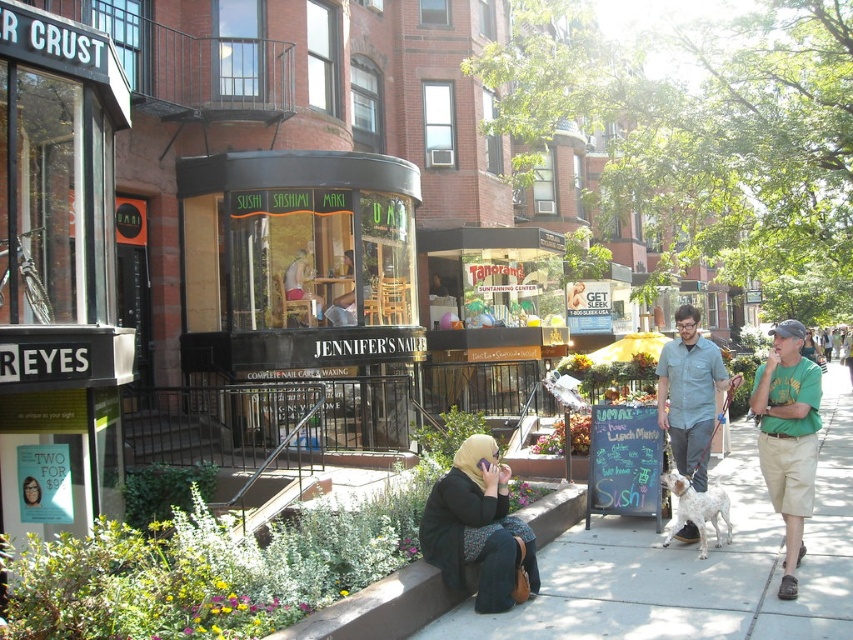
Question: Which point is closer to the camera taking this photo?

Choices:
 (A) (666, 428)
 (B) (769, 477)

Answer: (B)

Question: Does dark gray concrete curb at lower center have a smaller size compared to light blue shirt at center?

Choices:
 (A) yes
 (B) no

Answer: (A)

Question: Is concrete sidewalk at lower center positioned behind light blue shirt at center?

Choices:
 (A) no
 (B) yes

Answer: (A)

Question: Which point is farther to the camera?

Choices:
 (A) (428, 520)
 (B) (740, 595)
 (C) (276, 289)
 (D) (659, 412)

Answer: (C)

Question: Is the position of green cotton shirt at right less distant than that of dark gray concrete curb at lower center?

Choices:
 (A) yes
 (B) no

Answer: (A)

Question: Which is nearer to the matte black hijab at center?

Choices:
 (A) green cotton shirt at right
 (B) light blue shirt at center
 (C) concrete sidewalk at lower center

Answer: (C)